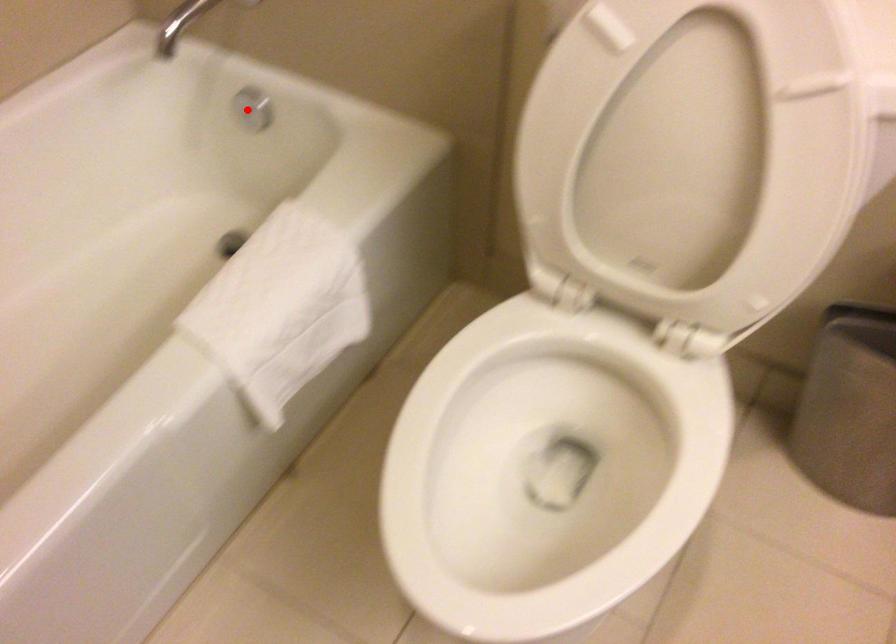
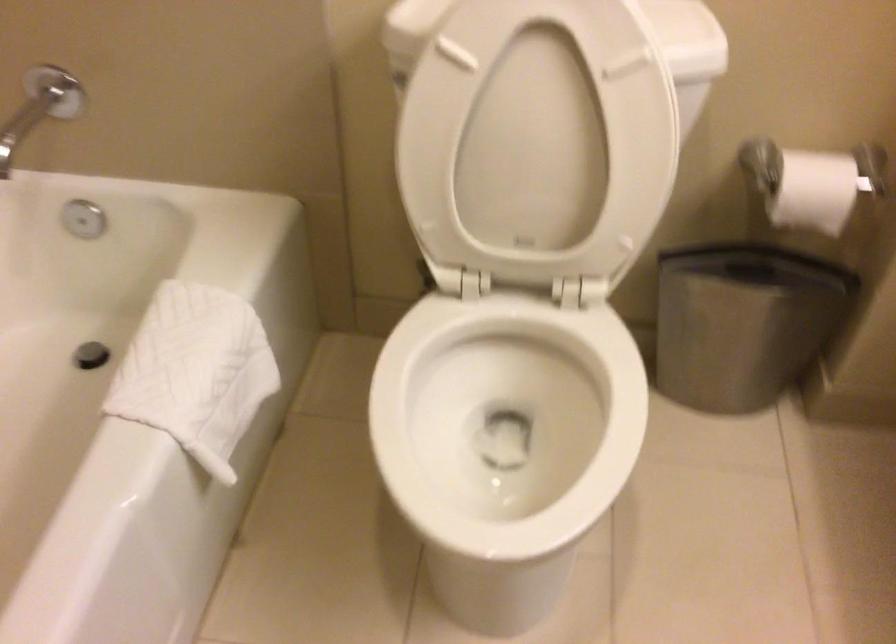
Locate, in the second image, the point that corresponds to the highlighted location in the first image.

(83, 219)